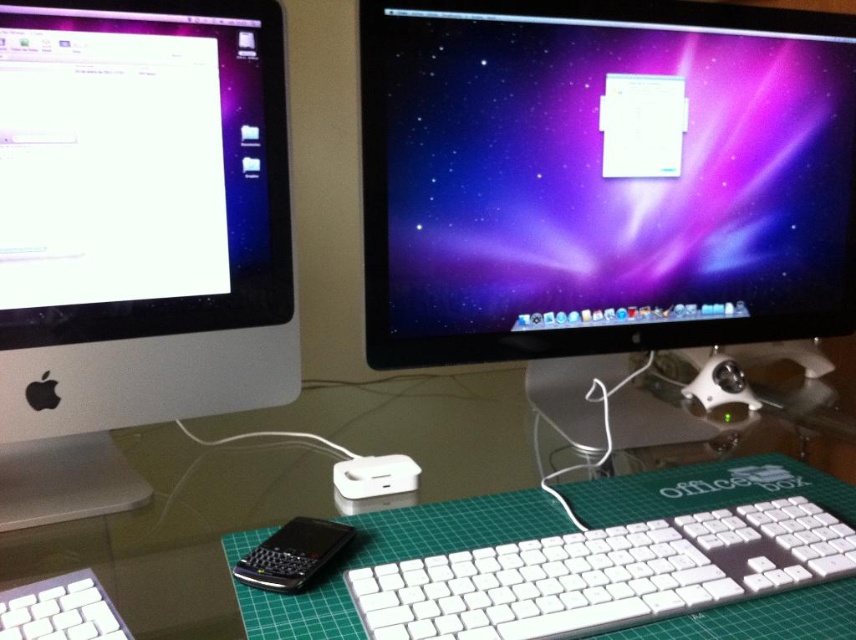
Question: Which is farther from the white plastic keyboard at lower left?

Choices:
 (A) white plastic keyboard at center
 (B) satin black monitor at center
 (C) white glossy computer monitor at left
 (D) transparent glass computer desk at center

Answer: (B)

Question: Which point is closer to the camera taking this photo?

Choices:
 (A) (0, 595)
 (B) (10, 504)

Answer: (A)

Question: Is satin black monitor at center wider than transparent glass computer desk at center?

Choices:
 (A) no
 (B) yes

Answer: (A)

Question: Does white plastic keyboard at center have a larger size compared to white plastic keyboard at lower left?

Choices:
 (A) no
 (B) yes

Answer: (B)

Question: Can you confirm if white plastic keyboard at center is positioned to the left of transparent glass computer desk at center?

Choices:
 (A) no
 (B) yes

Answer: (B)

Question: Among these objects, which one is farthest from the camera?

Choices:
 (A) transparent glass computer desk at center
 (B) satin black monitor at center
 (C) white plastic keyboard at lower left

Answer: (B)